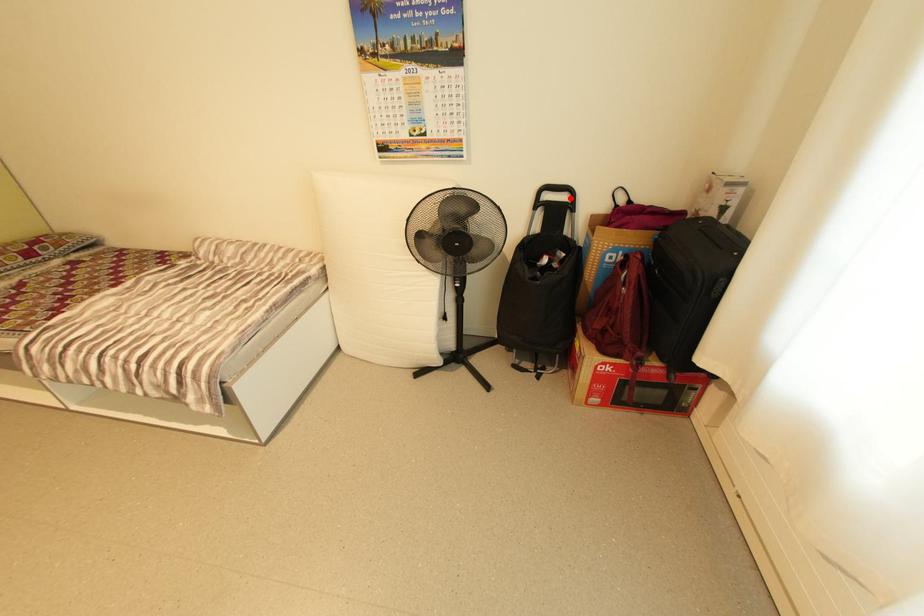
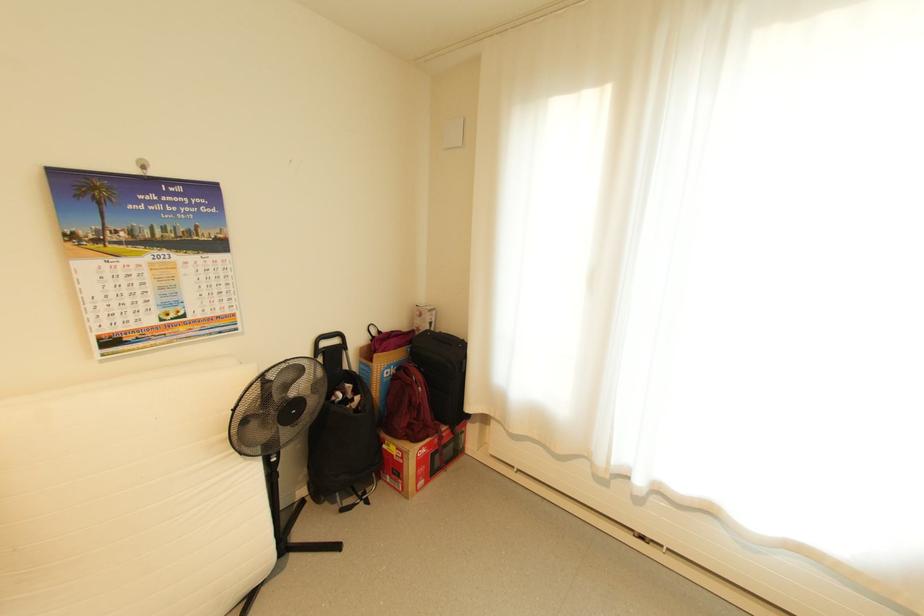
Find the pixel in the second image that matches the highlighted location in the first image.

(342, 342)